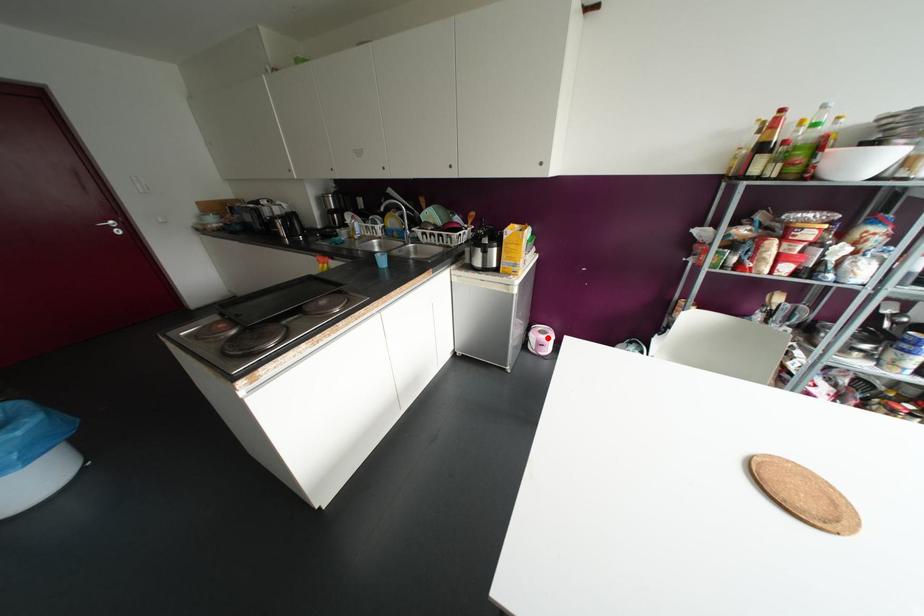
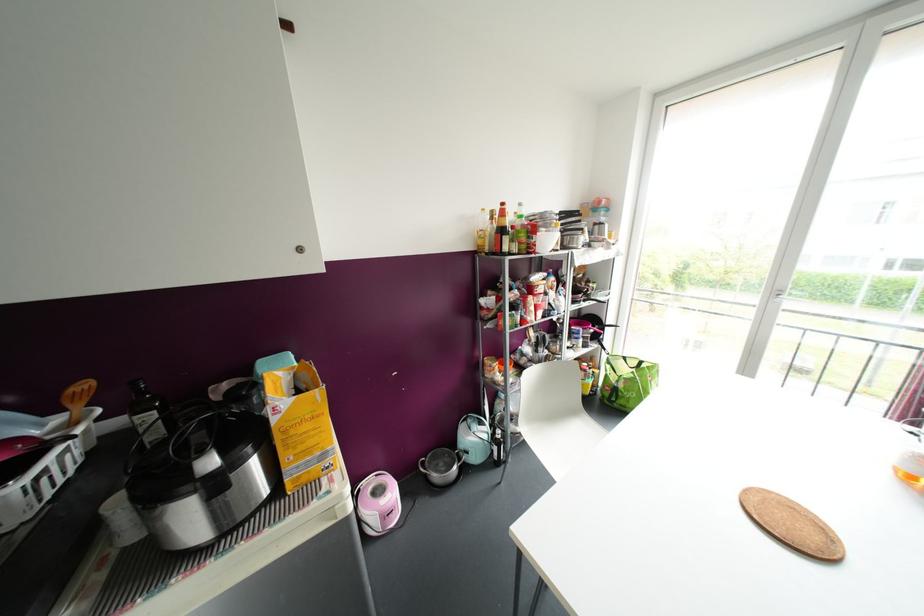
Question: I am providing you with two images of the same scene from different viewpoints. In image1, a red point is highlighted. Considering the same 3D point in image2, which of the following is correct?

Choices:
 (A) It is closer
 (B) It is farther

Answer: (A)